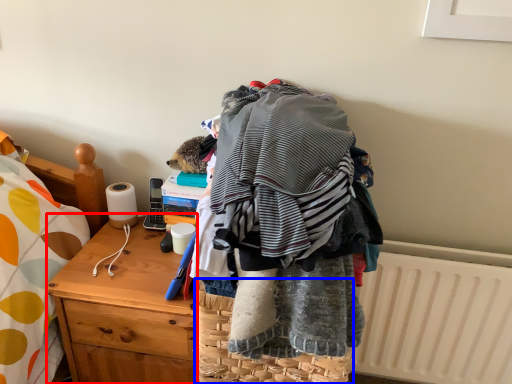
Question: Which of the following is the closest to the observer, desk (highlighted by a red box) or picnic basket (highlighted by a blue box)?

Choices:
 (A) desk
 (B) picnic basket

Answer: (B)